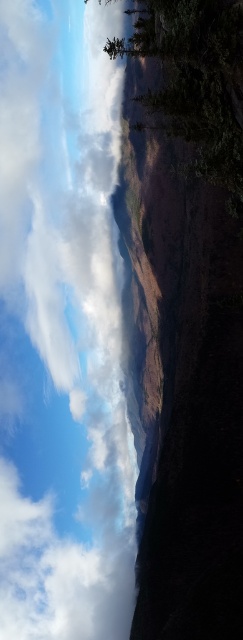
Question: Is white fluffy cloud at upper left positioned before green matte tree at upper center?

Choices:
 (A) no
 (B) yes

Answer: (A)

Question: Which of the following is the farthest from the observer?

Choices:
 (A) green matte tree at upper center
 (B) white fluffy cloud at upper left

Answer: (B)

Question: Is white fluffy cloud at upper left below green matte tree at upper center?

Choices:
 (A) yes
 (B) no

Answer: (A)

Question: Is white fluffy cloud at upper left positioned in front of green matte tree at upper center?

Choices:
 (A) no
 (B) yes

Answer: (A)